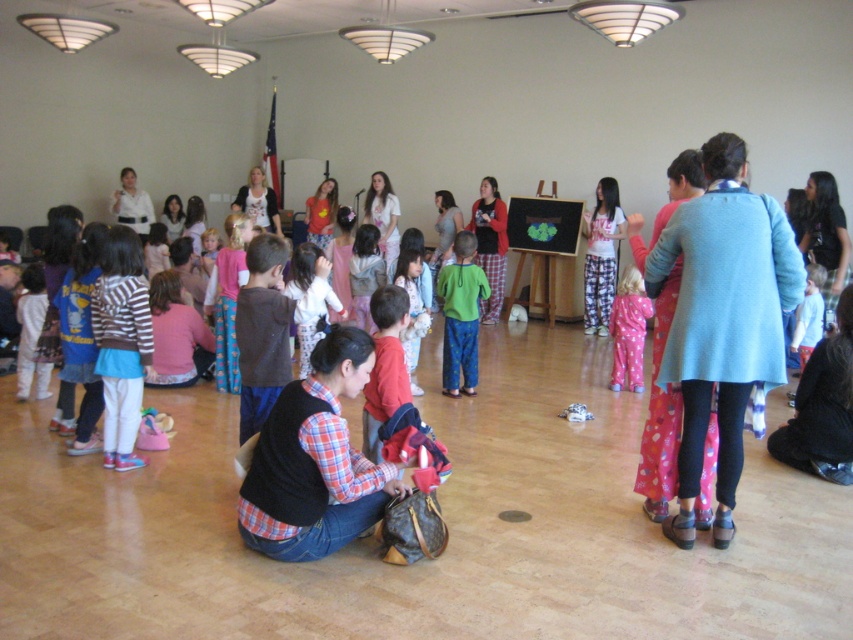
Does green cotton shirt at center have a lesser height compared to pink pajama pants at center?

Incorrect, green cotton shirt at center's height does not fall short of pink pajama pants at center's.

Is green cotton shirt at center behind pink pajama pants at center?

No.

The height and width of the screenshot is (640, 853). What are the coordinates of `green cotton shirt at center` in the screenshot? It's located at (461, 316).

Which is behind, point (647, 304) or point (316, 300)?

Positioned behind is point (647, 304).

How far apart are pink pajama pants at center and white cotton shirt at center?

The distance of pink pajama pants at center from white cotton shirt at center is 2.18 meters.

Find the location of `pink pajama pants at center`. pink pajama pants at center is located at coordinates (628, 330).

Where is `pink pajama pants at center`? Image resolution: width=853 pixels, height=640 pixels. pink pajama pants at center is located at coordinates (628, 330).

Is plaid shirt at center smaller than striped cotton shirt at lower left?

No, plaid shirt at center is not smaller than striped cotton shirt at lower left.

Is plaid shirt at center below striped cotton shirt at lower left?

Yes.

Between point (357, 493) and point (123, 273), which one is positioned behind?

The point (123, 273) is more distant.

At what (x,y) coordinates should I click in order to perform the action: click on plaid shirt at center. Please return your answer as a coordinate pair (x, y). The image size is (853, 640). Looking at the image, I should click on (314, 461).